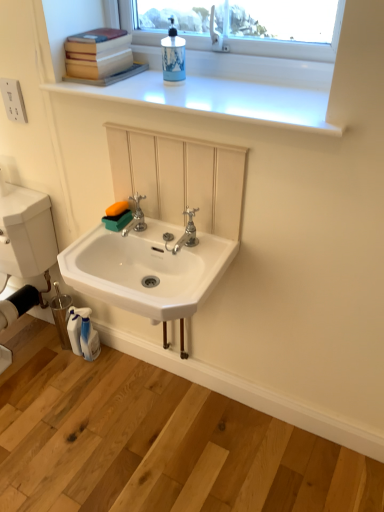
Locate an element on the screen. The image size is (384, 512). vacant area situated below white glossy sink at center (from a real-world perspective) is located at coordinates (152, 406).